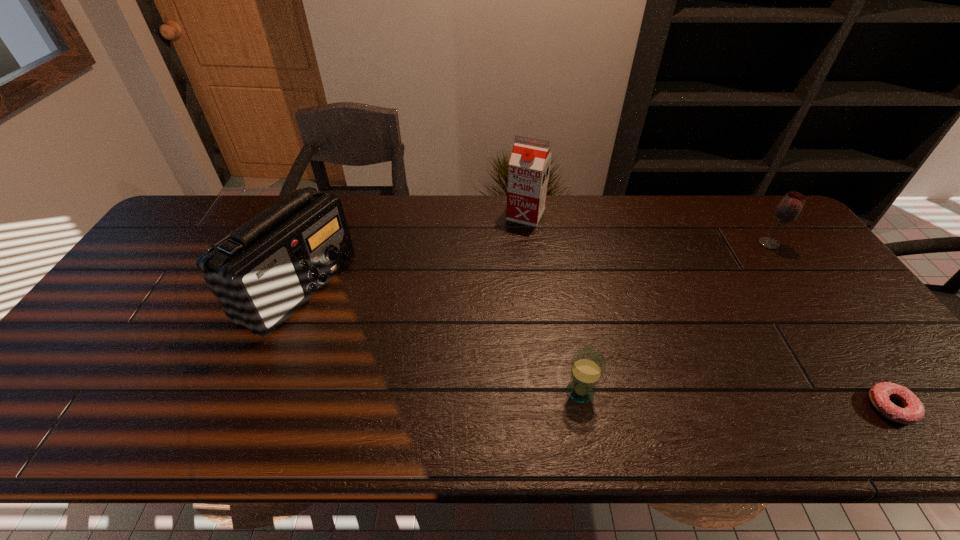
This screenshot has height=540, width=960. In order to click on free region located 0.380m on the left of the nearer glass in this screenshot , I will do `click(397, 392)`.

The height and width of the screenshot is (540, 960). In order to click on blank space located 0.400m on the back of the doughnut in this screenshot , I will do `click(790, 267)`.

Where is `soya milk located at the far edge`? Image resolution: width=960 pixels, height=540 pixels. soya milk located at the far edge is located at coordinates (528, 172).

Find the location of a particular element. glass drink container that is at the far edge is located at coordinates (789, 208).

This screenshot has width=960, height=540. I want to click on glass at the near edge, so click(x=587, y=365).

Where is `doughnut situated at the near edge`? The width and height of the screenshot is (960, 540). doughnut situated at the near edge is located at coordinates (913, 410).

Where is `glass drink container that is at the right edge`? glass drink container that is at the right edge is located at coordinates (789, 208).

Where is `doughnut located at the right edge`? This screenshot has height=540, width=960. doughnut located at the right edge is located at coordinates point(913,410).

Identify the location of object that is at the far right corner. (789, 208).

Image resolution: width=960 pixels, height=540 pixels. In order to click on object located in the near right corner section of the desktop in this screenshot , I will do `click(913, 410)`.